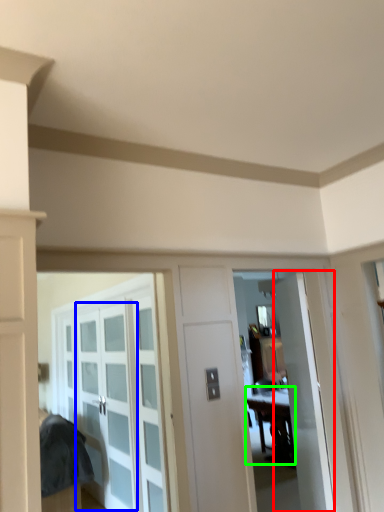
Question: Based on their relative distances, which object is farther from door (highlighted by a red box)? Choose from glass door (highlighted by a blue box) and table (highlighted by a green box).

Choices:
 (A) glass door
 (B) table

Answer: (B)